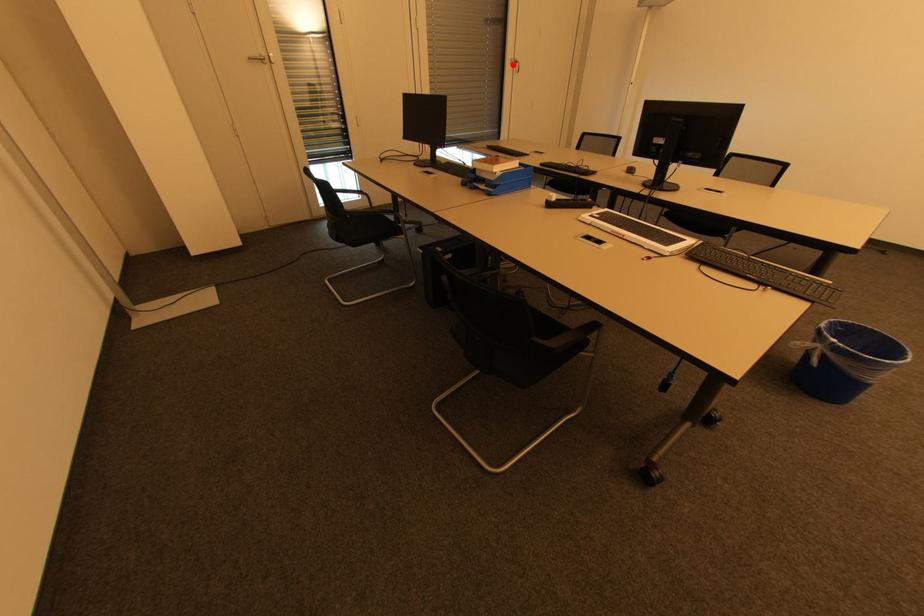
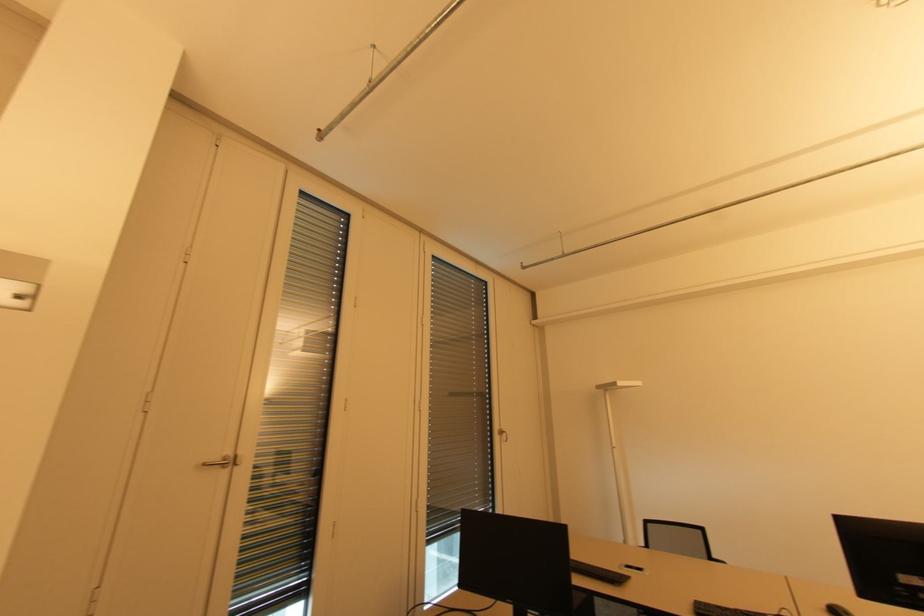
The point at the highlighted location is marked in the first image. Where is the corresponding point in the second image?

(501, 435)